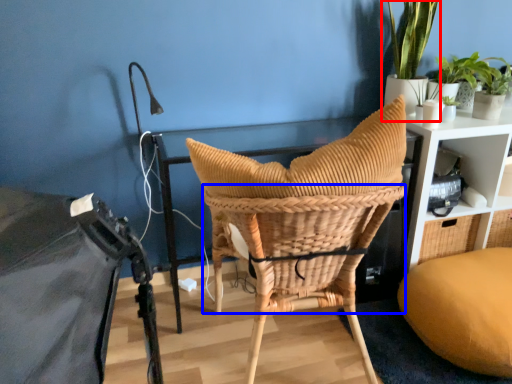
Question: Which point is closer to the camera, houseplant (highlighted by a red box) or basket (highlighted by a blue box)?

Choices:
 (A) houseplant
 (B) basket

Answer: (B)